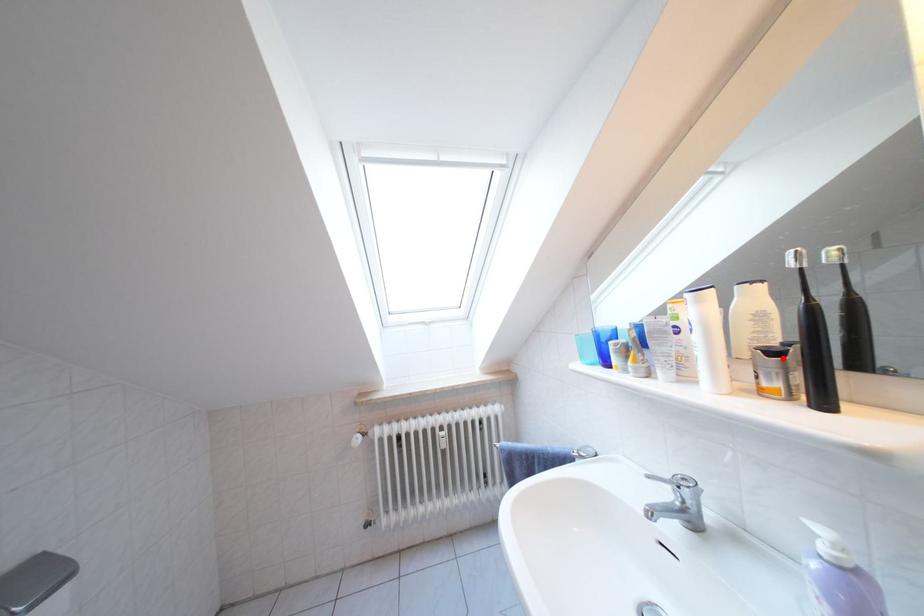
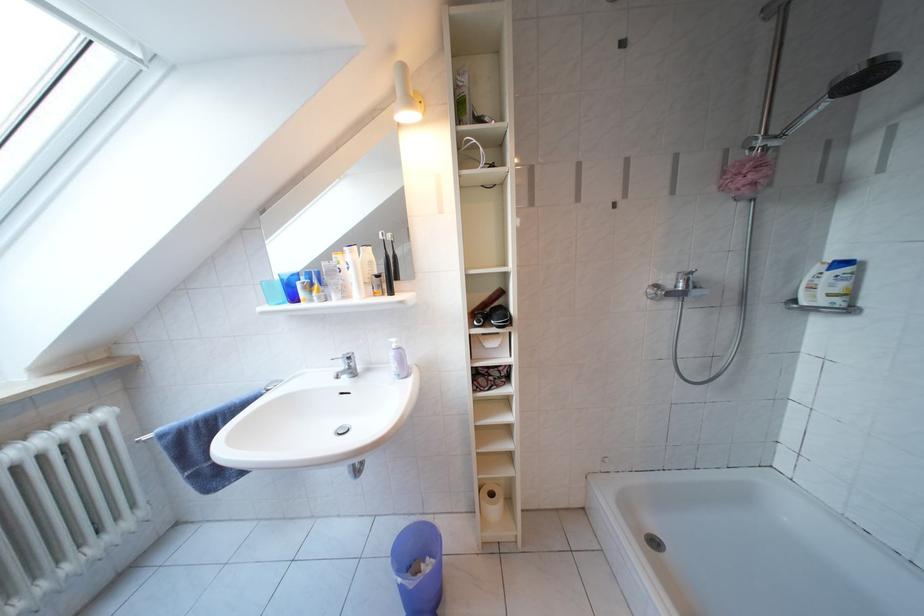
Find the pixel in the second image that matches the highlighted location in the first image.

(386, 281)